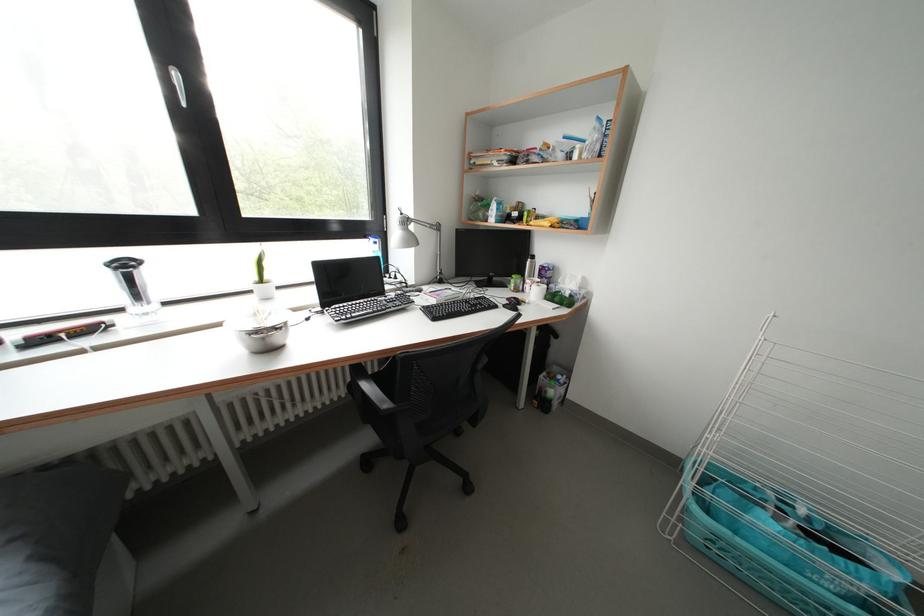
Where would you pull the white window handle? Please return your answer as a coordinate pair (x, y).

(177, 84)